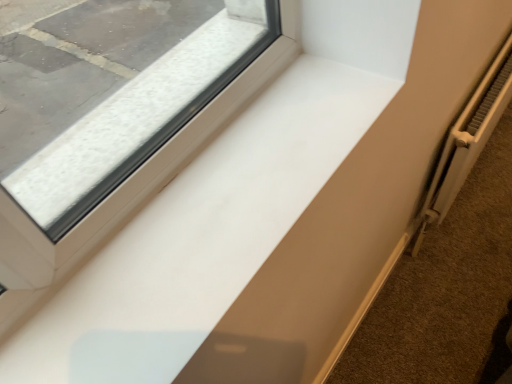
Question: Considering the positions of point (178, 117) and point (449, 208), is point (178, 117) closer or farther from the camera than point (449, 208)?

Choices:
 (A) closer
 (B) farther

Answer: (A)

Question: Based on their sizes in the image, would you say white glossy window sill at center is bigger or smaller than white metallic radiator at right?

Choices:
 (A) big
 (B) small

Answer: (B)

Question: Which object is the closest to the white metallic radiator at right?

Choices:
 (A) white matte radiator at lower right
 (B) white glossy window sill at center

Answer: (A)

Question: Estimate the real-world distances between objects in this image. Which object is closer to the white matte radiator at lower right?

Choices:
 (A) white metallic radiator at right
 (B) white glossy window sill at center

Answer: (A)